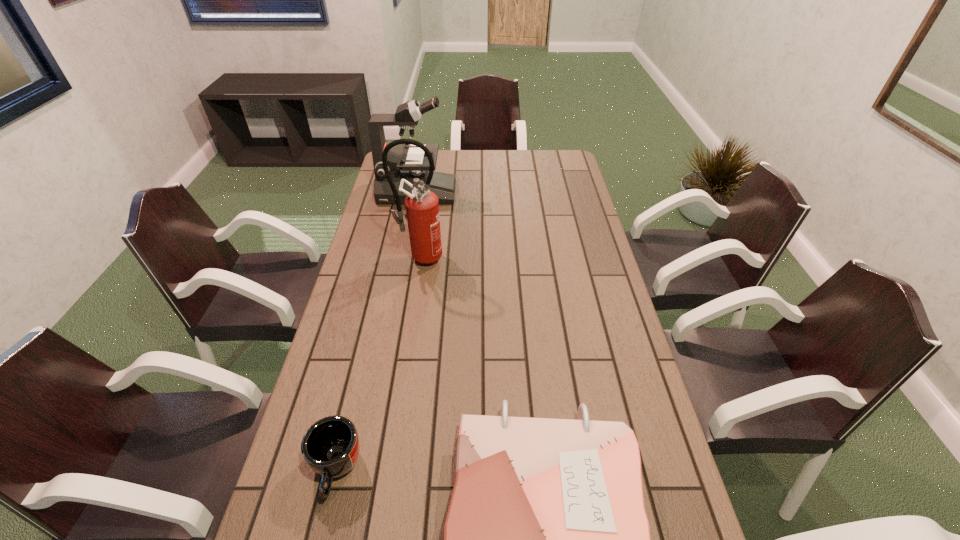
The image size is (960, 540). What are the coordinates of `the third nearest object` in the screenshot? It's located at (422, 205).

Where is `microscope`? This screenshot has width=960, height=540. microscope is located at coordinates (408, 162).

Where is `mug`? The width and height of the screenshot is (960, 540). mug is located at coordinates (330, 447).

At what (x,y) coordinates should I click in order to perform the action: click on vacant space located 0.400m at the nozzle of the fire extinguisher. Please return your answer as a coordinate pair (x, y). The width and height of the screenshot is (960, 540). Looking at the image, I should click on (403, 369).

The width and height of the screenshot is (960, 540). Find the location of `vacant space situated 0.160m through the eyepieces of the farthest object`. vacant space situated 0.160m through the eyepieces of the farthest object is located at coordinates (493, 192).

Where is `fire extinguisher at the left edge`? fire extinguisher at the left edge is located at coordinates (422, 205).

You are a GUI agent. You are given a task and a screenshot of the screen. Output one action in this format:
    pyautogui.click(x=<x>, y=<y>)
    Task: Click on the microscope present at the left edge
    This screenshot has height=540, width=960.
    Given the screenshot: What is the action you would take?
    pos(408,162)

You are a GUI agent. You are given a task and a screenshot of the screen. Output one action in this format:
    pyautogui.click(x=<x>, y=<y>)
    Task: Click on the mug that is at the left edge
    
    Given the screenshot: What is the action you would take?
    pyautogui.click(x=330, y=447)

In the image, there is a desktop. At what (x,y) coordinates should I click in order to perform the action: click on vacant space at the right edge. Please return your answer as a coordinate pair (x, y). The height and width of the screenshot is (540, 960). Looking at the image, I should click on (589, 287).

You are a GUI agent. You are given a task and a screenshot of the screen. Output one action in this format:
    pyautogui.click(x=<x>, y=<y>)
    Task: Click on the empty location between the mug and the microscope
    The image size is (960, 540).
    Given the screenshot: What is the action you would take?
    pyautogui.click(x=376, y=330)